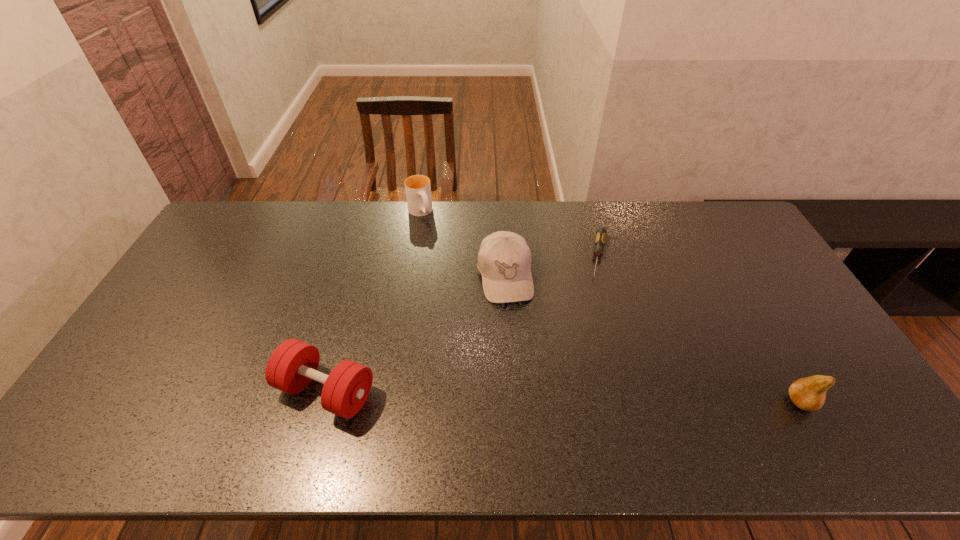
Where is `free space on the desktop that is between the dumbbell and the pear and is positioned on the front-facing side of the third object from right to left`? free space on the desktop that is between the dumbbell and the pear and is positioned on the front-facing side of the third object from right to left is located at coordinates (529, 396).

Image resolution: width=960 pixels, height=540 pixels. I want to click on free space on the desktop that is between the dumbbell and the pear and is positioned with the handle on the side of the cup, so click(x=535, y=396).

Find the location of a particular element. The width and height of the screenshot is (960, 540). vacant space on the desktop that is between the dumbbell and the rightmost object and is positioned insert the screwdriver into a screw head is located at coordinates [575, 397].